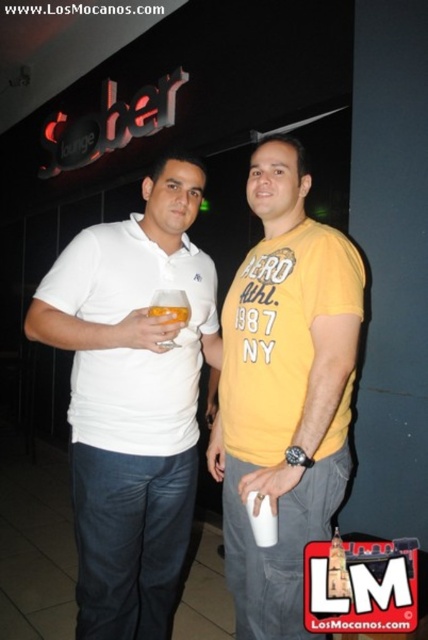
Question: Estimate the real-world distances between objects in this image. Which object is farther from the translucent glass at center?

Choices:
 (A) white matte polo shirt at center
 (B) white cotton polo shirt at left

Answer: (A)

Question: Is yellow cotton t-shirt at center behind translucent glass at center?

Choices:
 (A) no
 (B) yes

Answer: (A)

Question: Is yellow cotton t-shirt at center positioned before white cotton polo shirt at left?

Choices:
 (A) no
 (B) yes

Answer: (B)

Question: Which of the following is the closest to the observer?

Choices:
 (A) translucent glass at center
 (B) yellow cotton t-shirt at center
 (C) white matte polo shirt at center

Answer: (B)

Question: Does white matte polo shirt at center have a lesser width compared to white cotton polo shirt at left?

Choices:
 (A) no
 (B) yes

Answer: (A)

Question: Which is nearer to the translucent glass at center?

Choices:
 (A) white cotton polo shirt at left
 (B) yellow cotton t-shirt at center

Answer: (A)